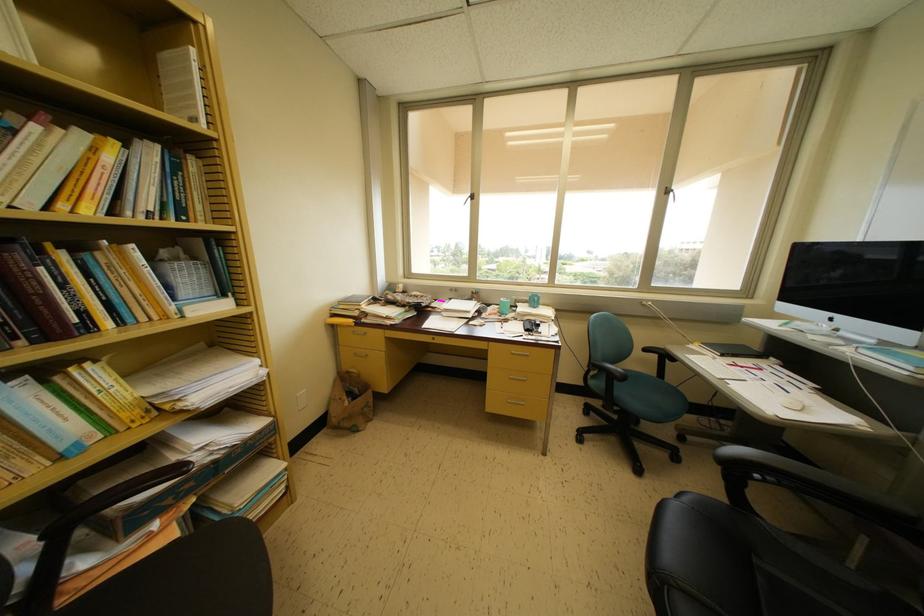
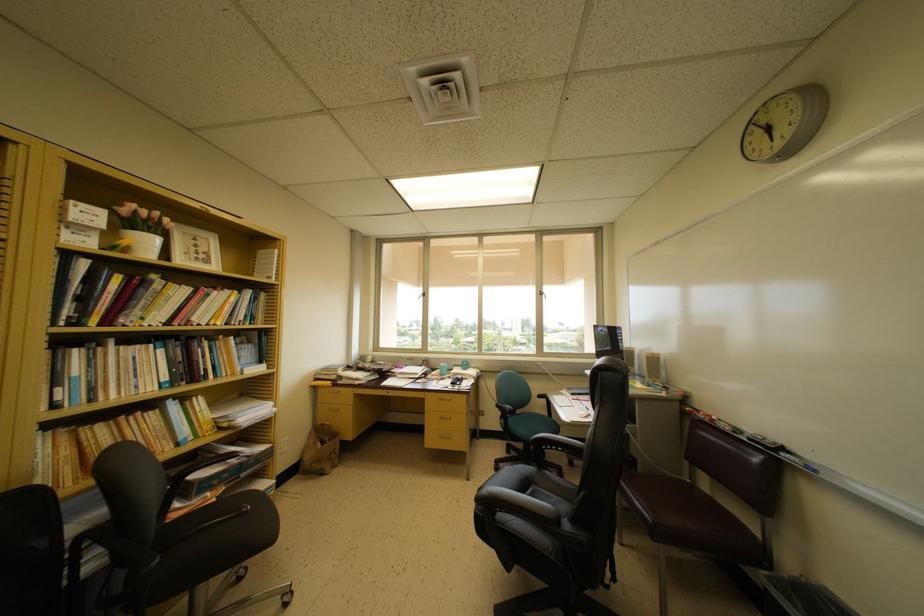
Question: I am providing you with two images of the same scene from different viewpoints. Which of the following objects are not visible in image2?

Choices:
 (A) grey chair sitting surface
 (B) book
 (C) white flower pot
 (D) none of these

Answer: (D)